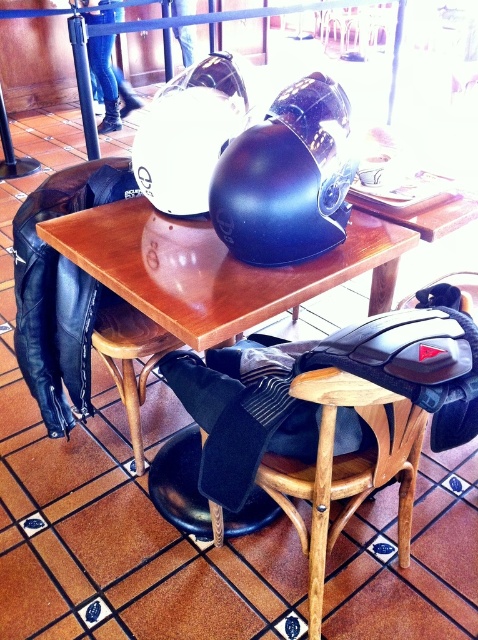
You are a customer sitting in the brown leather chair at center and want to pick up the glossy black helmet at center. Can you reach it without moving from your seat?

The glossy black helmet at center is in front of the brown leather chair at center, so you can reach it without moving from your seat.

Consider the image. You are a delivery person who needs to place a package between the glossy black helmet at center and the wooden chair at lower center. Considering their thickness, can the package fit between them?

The glossy black helmet at center is thinner than the wooden chair at lower center. Since the helmet is thinner, there might be enough space between them for the package, but it depends on the package size. However, the description only mentions their thickness relative to each other, not the exact dimensions. Without knowing the package size, we cannot confirm if it will fit. Please provide the package dimensions for an accurate assessment.